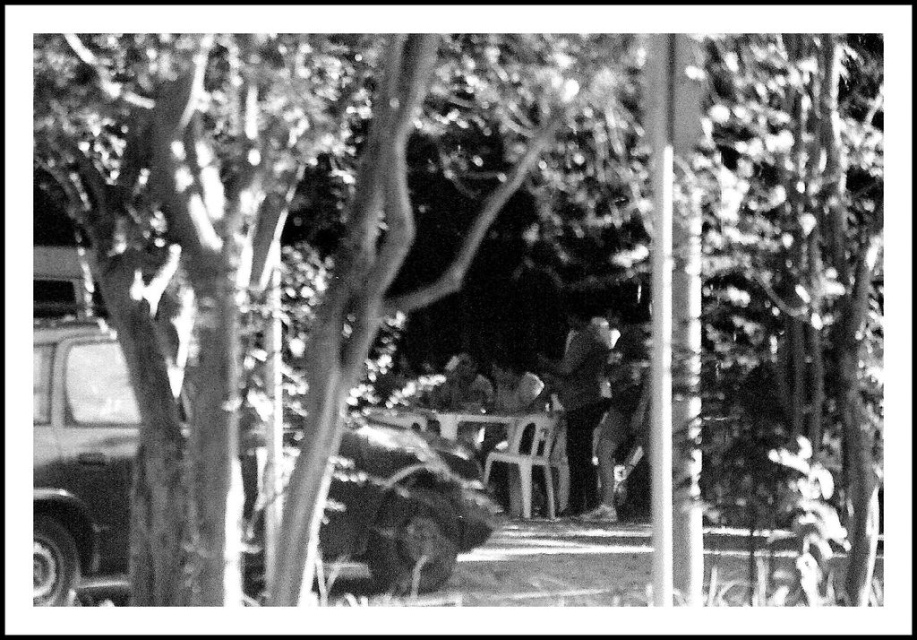
Who is more distant from viewer, (x=359, y=561) or (x=572, y=460)?

The point (x=572, y=460) is more distant.

Describe the element at coordinates (80, 461) in the screenshot. I see `dark matte car at left` at that location.

Identify the location of dark matte car at left. (x=80, y=461).

Which is in front, point (584, 493) or point (529, 426)?

Point (529, 426) is in front.

This screenshot has height=640, width=917. What are the coordinates of `dark textured jacket at center` in the screenshot? It's located at (580, 404).

Which of these two, dark matte car at left or white plastic chair at center, stands shorter?

white plastic chair at center is shorter.

At what (x,y) coordinates should I click in order to perform the action: click on dark matte car at left. Please return your answer as a coordinate pair (x, y). The height and width of the screenshot is (640, 917). Looking at the image, I should click on (80, 461).

Identify the location of dark matte car at left. This screenshot has height=640, width=917. (80, 461).